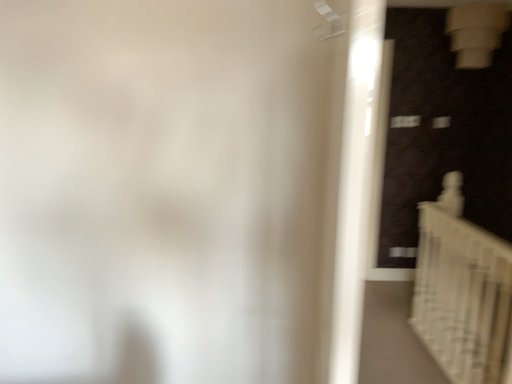
Question: Which is correct: white glossy door at right is inside white glossy staircase at lower right, or outside of it?

Choices:
 (A) outside
 (B) inside

Answer: (A)

Question: Visually, is white glossy door at right positioned to the left or to the right of white glossy staircase at lower right?

Choices:
 (A) left
 (B) right

Answer: (A)

Question: From the image's perspective, is white glossy door at right located above or below white glossy staircase at lower right?

Choices:
 (A) above
 (B) below

Answer: (A)

Question: In the image, is white glossy staircase at lower right positioned in front of or behind white glossy door at right?

Choices:
 (A) front
 (B) behind

Answer: (B)

Question: Considering the positions of white glossy staircase at lower right and white glossy door at right in the image, is white glossy staircase at lower right wider or thinner than white glossy door at right?

Choices:
 (A) wide
 (B) thin

Answer: (B)

Question: Is white glossy staircase at lower right taller or shorter than white glossy door at right?

Choices:
 (A) short
 (B) tall

Answer: (A)

Question: Is point (431, 264) positioned closer to the camera than point (347, 89)?

Choices:
 (A) closer
 (B) farther

Answer: (B)